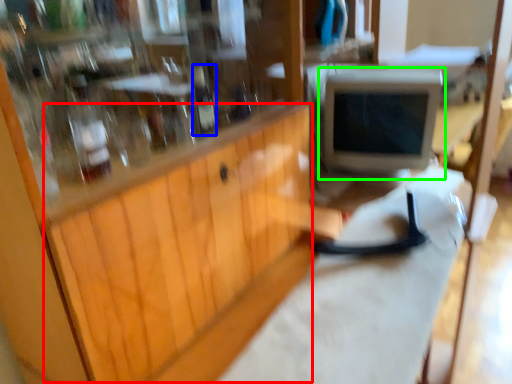
Question: Based on their relative distances, which object is nearer to wood (highlighted by a red box)? Choose from bottle (highlighted by a blue box) and computer monitor (highlighted by a green box).

Choices:
 (A) bottle
 (B) computer monitor

Answer: (A)